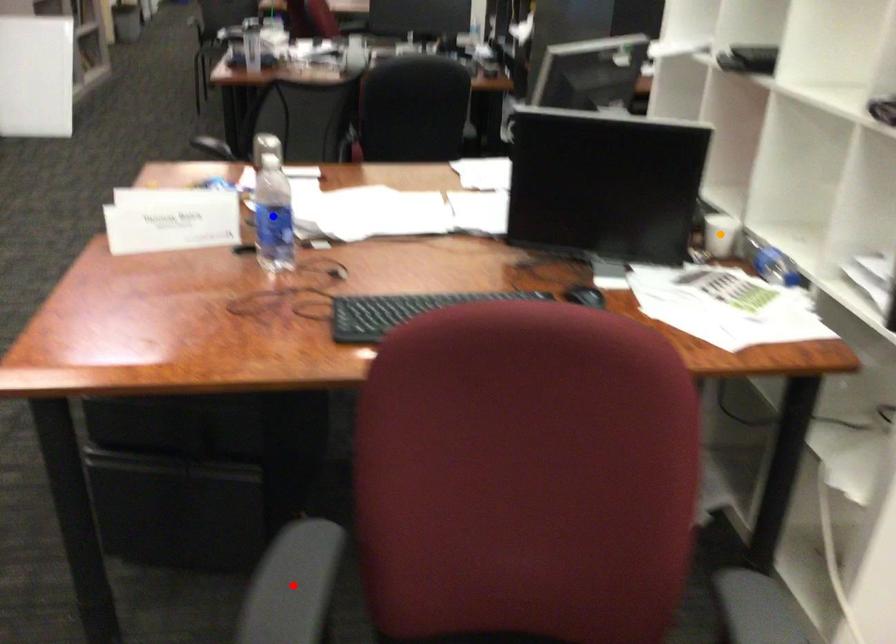
Order these from farthest to nearest:
- red point
- orange point
- blue point

orange point
blue point
red point